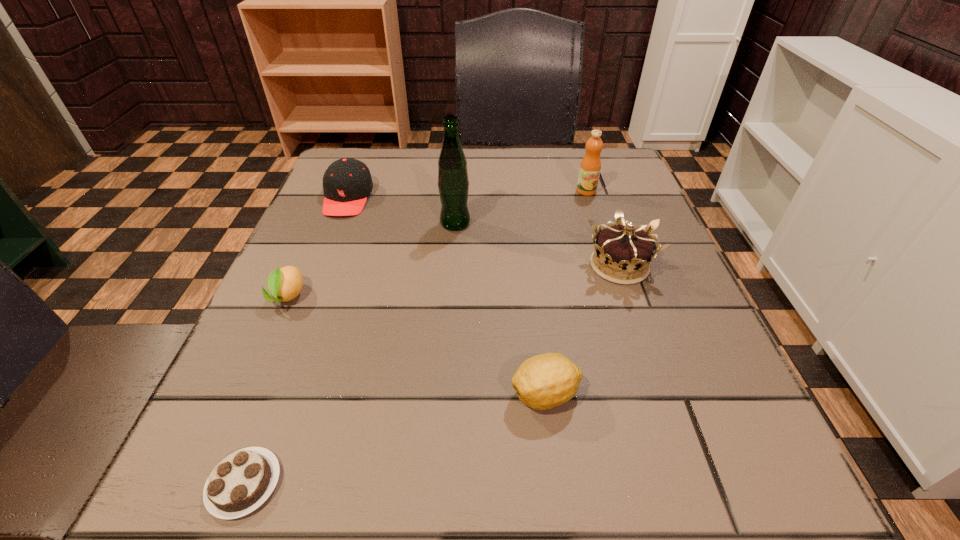
You are a GUI agent. You are given a task and a screenshot of the screen. Output one action in this format:
    pyautogui.click(x=<x>, y=<y>)
    Task: Click on the vacant area that lies between the sixth farthest object and the cap
    The width and height of the screenshot is (960, 540).
    Given the screenshot: What is the action you would take?
    pyautogui.click(x=446, y=296)

Locate an element on the screen. Image resolution: width=960 pixels, height=540 pixels. vacant space that's between the fourth object from right to left and the crown is located at coordinates (538, 245).

The height and width of the screenshot is (540, 960). I want to click on vacant space that is in between the chocolate cake and the farther lemon, so click(266, 390).

You are a GUI agent. You are given a task and a screenshot of the screen. Output one action in this format:
    pyautogui.click(x=<x>, y=<y>)
    Task: Click on the empty space between the orange juice and the sixth tallest object
    Image resolution: width=960 pixels, height=540 pixels.
    Given the screenshot: What is the action you would take?
    pyautogui.click(x=437, y=244)

Where is `free space between the fifth object from left to right and the tallest object`? Image resolution: width=960 pixels, height=540 pixels. free space between the fifth object from left to right and the tallest object is located at coordinates (500, 309).

At what (x,y) coordinates should I click in order to perform the action: click on vacant area between the sixth tallest object and the cap. Please return your answer as a coordinate pair (x, y). Looking at the image, I should click on (318, 247).

This screenshot has width=960, height=540. What are the coordinates of `object that is the third closest one to the third tallest object` in the screenshot? It's located at coord(453,184).

This screenshot has height=540, width=960. What are the coordinates of `object identified as the closest to the fifth object from left to right` in the screenshot? It's located at click(620, 249).

Where is `free region that satisfies the following two spatial constraints: 1. on the front label of the third tallest object; 2. on the left side of the sixth shortest object`? free region that satisfies the following two spatial constraints: 1. on the front label of the third tallest object; 2. on the left side of the sixth shortest object is located at coordinates (611, 266).

This screenshot has height=540, width=960. What are the coordinates of `vacant space that satisfies the following two spatial constraints: 1. on the front-facing side of the crown; 2. on the right side of the cap` in the screenshot? It's located at (321, 266).